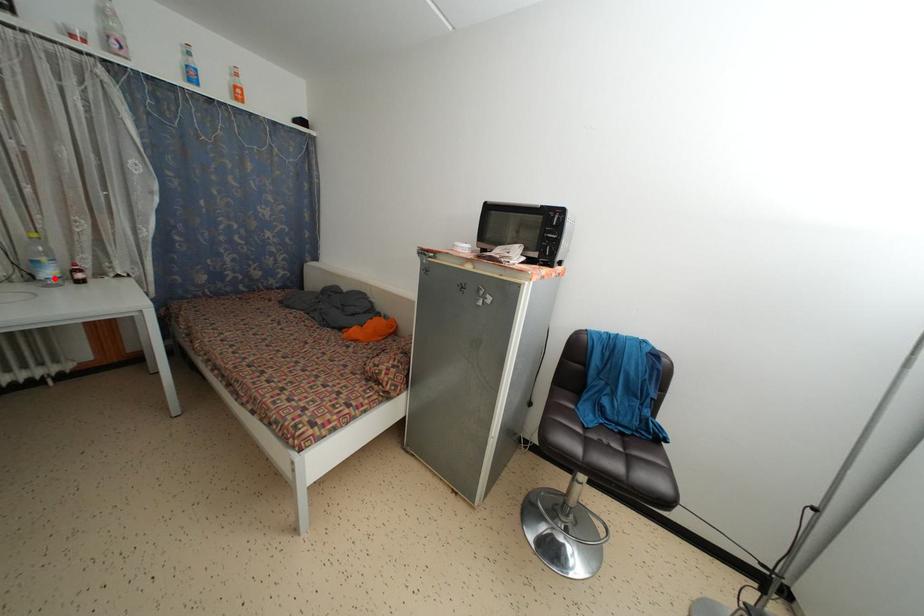
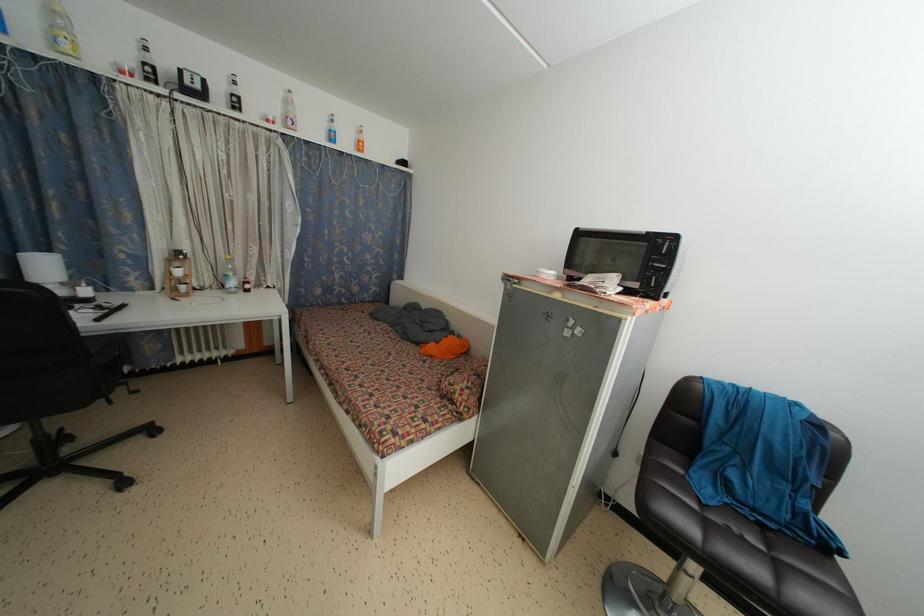
Where in the second image is the point corresponding to the highlighted location from the first image?

(237, 289)